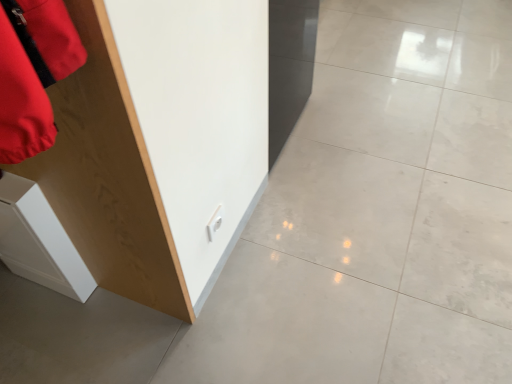
Question: Is white polished concrete at center in front of or behind wooden cabinet at left in the image?

Choices:
 (A) behind
 (B) front

Answer: (A)

Question: In terms of size, does white polished concrete at center appear bigger or smaller than wooden cabinet at left?

Choices:
 (A) small
 (B) big

Answer: (B)

Question: Which object is positioned farthest from the wooden cabinet at left?

Choices:
 (A) white polished concrete at center
 (B) white glossy cabinet at lower left

Answer: (A)

Question: Which object is positioned closest to the white glossy cabinet at lower left?

Choices:
 (A) wooden cabinet at left
 (B) white polished concrete at center

Answer: (A)